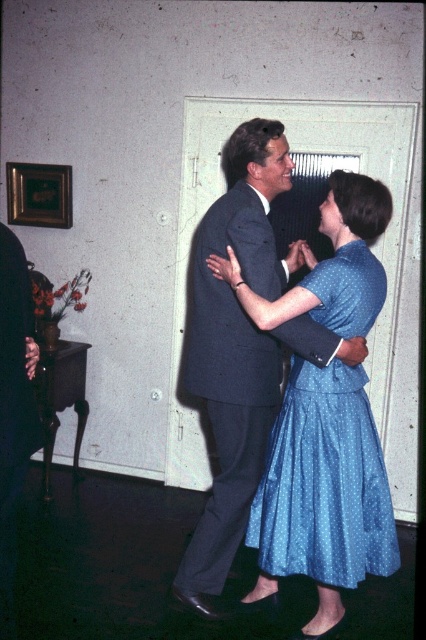
Looking at this image, is blue dotted dress at center closer to camera compared to blue dotted fabric dress at center?

No, it is not.

Can you confirm if blue dotted dress at center is positioned to the left of blue dotted fabric dress at center?

Yes, blue dotted dress at center is to the left of blue dotted fabric dress at center.

Locate an element on the screen. The image size is (426, 640). blue dotted dress at center is located at coordinates (247, 344).